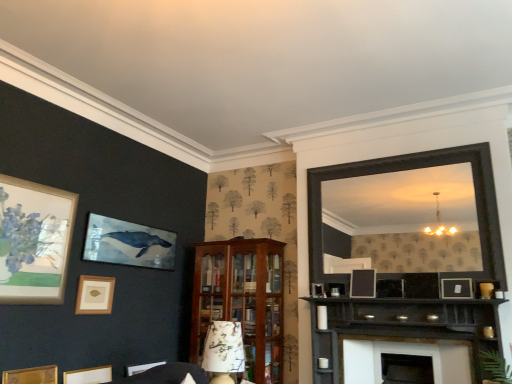
Locate an element on the screen. free space above matte black picture frame at upper right, acting as the fifth picture frame starting from the left (from a real-world perspective) is located at coordinates (455, 274).